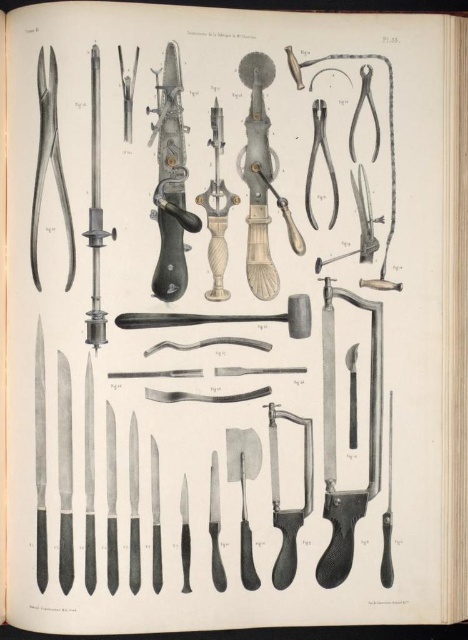
Does matte silver razor at left have a greater width compared to polished silver razor at center?

Indeed, matte silver razor at left has a greater width compared to polished silver razor at center.

Can you confirm if matte silver razor at left is positioned above polished silver razor at center?

Indeed, matte silver razor at left is positioned over polished silver razor at center.

Is point (41, 186) positioned behind point (99, 68)?

Yes, point (41, 186) is farther from viewer.

Identify the location of matte silver razor at left. This screenshot has height=640, width=468. (51, 164).

Based on the photo, which is more to the left, matte silver razor at left or matte black razor at center?

matte silver razor at left is more to the left.

Is matte silver razor at left positioned in front of matte black razor at center?

Yes.

Measure the distance between point (43, 140) and camera.

They are 1.20 meters apart.

At what (x,y) coordinates should I click in order to perform the action: click on matte silver razor at left. Please return your answer as a coordinate pair (x, y). The width and height of the screenshot is (468, 640). Looking at the image, I should click on click(51, 164).

Is matte metal razor at center positioned in front of matte black scalpel at upper left?

No, it is not.

Can you confirm if matte metal razor at center is positioned below matte black scalpel at upper left?

Correct, matte metal razor at center is located below matte black scalpel at upper left.

Where is `matte metal razor at center`? matte metal razor at center is located at coordinates (324, 161).